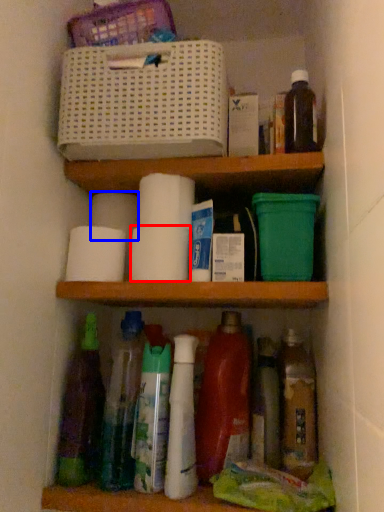
Question: Which object appears closest to the camera in this image, toilet paper (highlighted by a red box) or toilet paper (highlighted by a blue box)?

Choices:
 (A) toilet paper
 (B) toilet paper

Answer: (A)